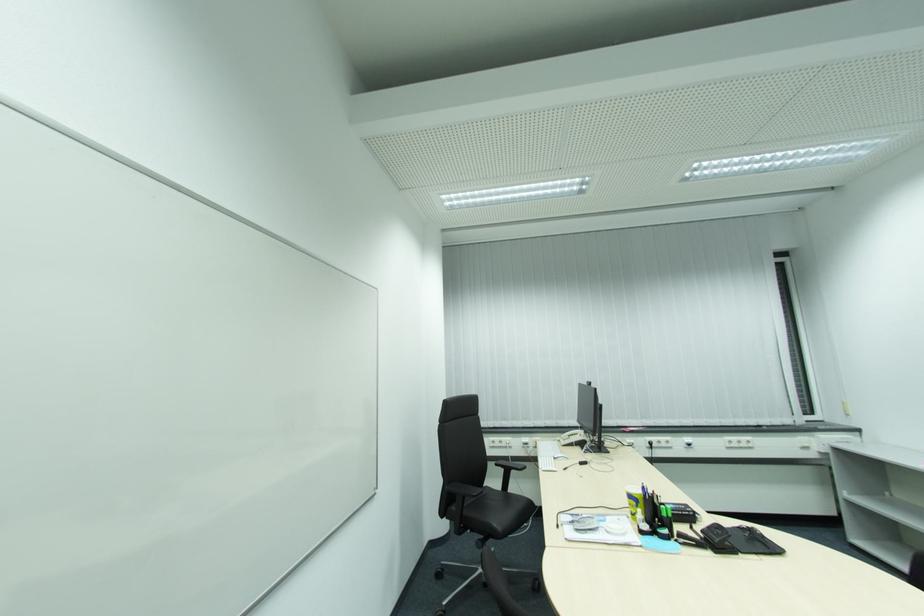
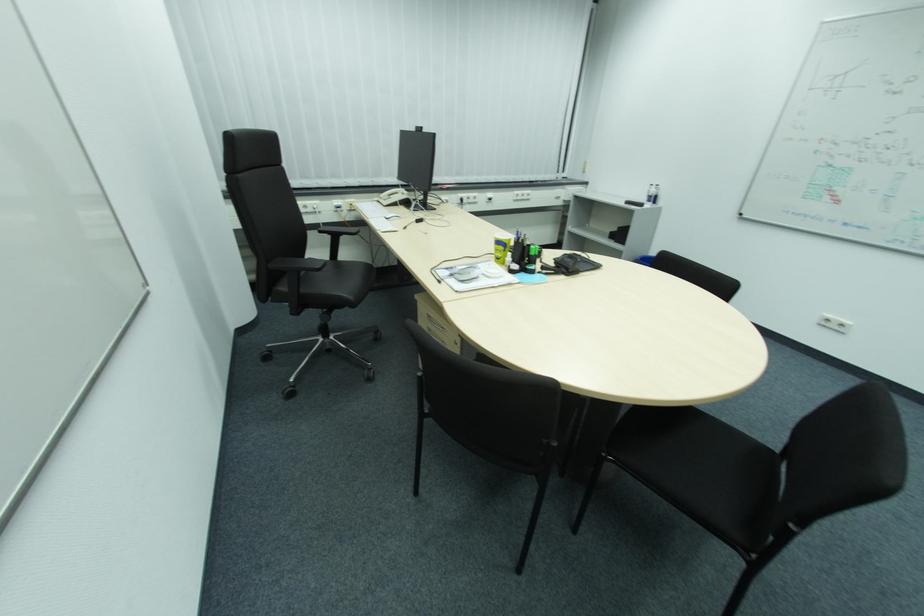
Locate, in the second image, the point that corresponds to pixel 639 503 in the first image.

(507, 248)